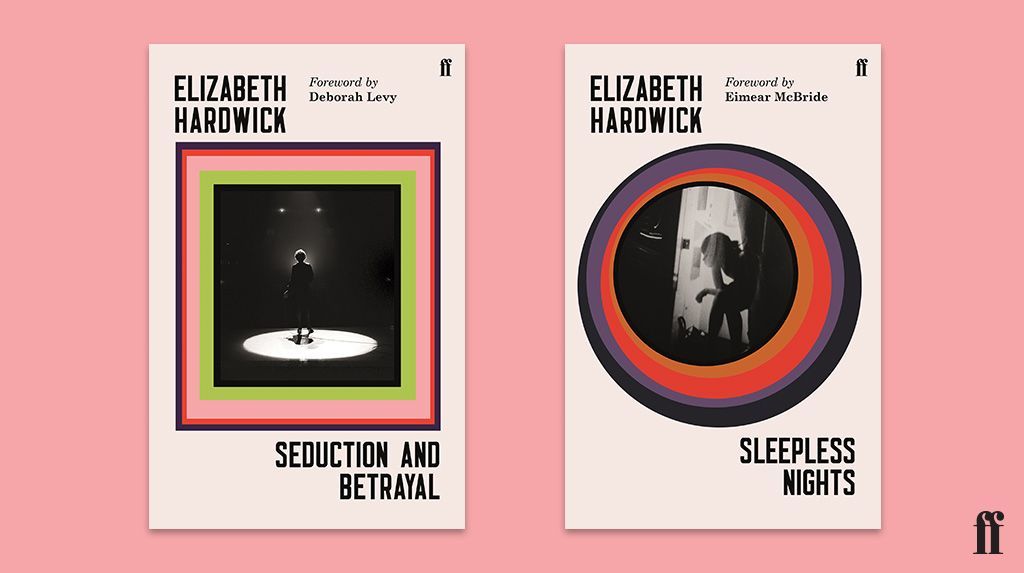
Find the location of `books`. books is located at coordinates coord(615,454), coord(216,470).